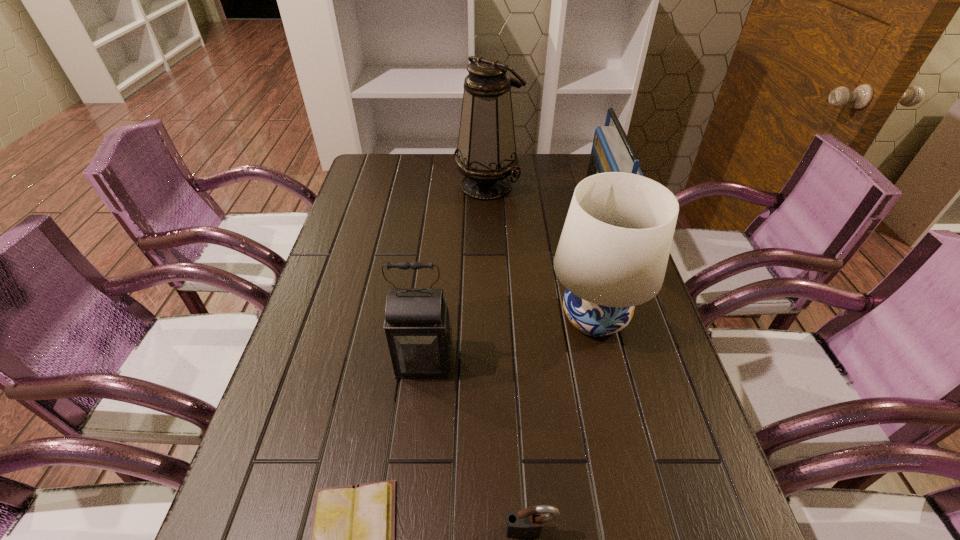
Locate an element on the screen. The width and height of the screenshot is (960, 540). blank space at the right edge is located at coordinates (662, 335).

Find the location of `vacant space at the far left corner of the desktop`. vacant space at the far left corner of the desktop is located at coordinates (371, 164).

Locate an element on the screen. This screenshot has width=960, height=540. vacant space at the far right corner of the desktop is located at coordinates (565, 167).

Identify the location of free spot between the tallest object and the radio receiver. (544, 199).

Where is `free area in between the fifth tallest object and the lantern`? This screenshot has height=540, width=960. free area in between the fifth tallest object and the lantern is located at coordinates (477, 447).

This screenshot has height=540, width=960. Identify the location of free space between the radio receiver and the lantern. (513, 287).

Find the location of a particular element. vacant area between the padlock and the radio receiver is located at coordinates (566, 372).

I want to click on vacant area that lies between the padlock and the lampshade, so click(x=563, y=424).

Identify the location of vacant space that's between the padlock and the tallest object. This screenshot has height=540, width=960. (509, 358).

At what (x,y) coordinates should I click in order to perform the action: click on vacant point located between the lampshade and the lantern. Please return your answer as a coordinate pair (x, y). Looking at the image, I should click on (509, 340).